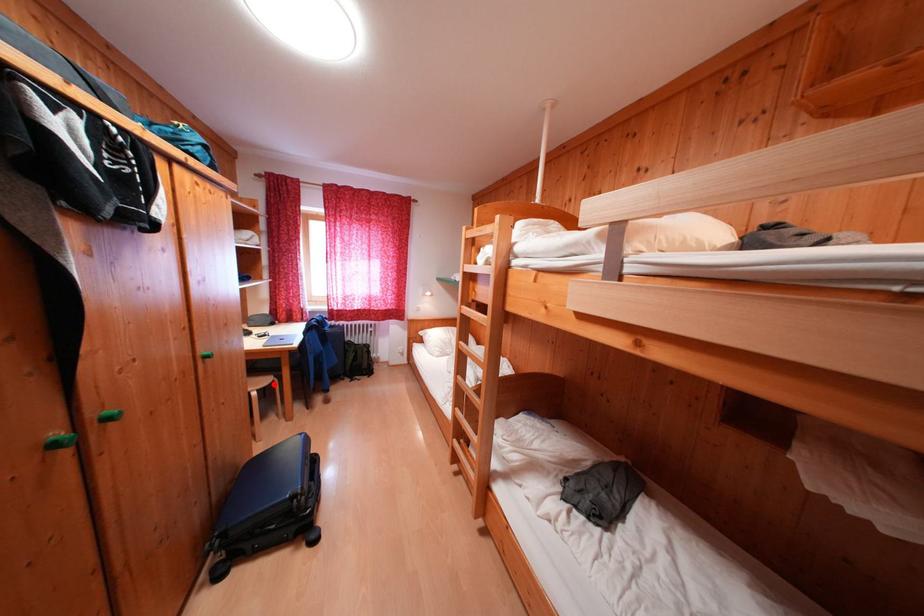
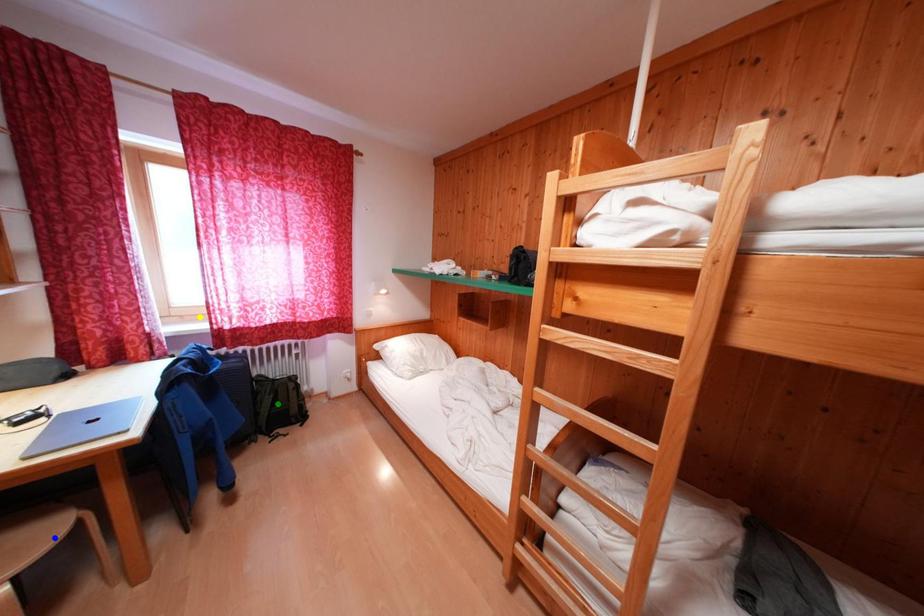
Question: I am providing you with two images of the same scene from different viewpoints. A red point is marked on the first image. You are given multiple points on the second image. Can you choose the point in image 2 that corresponds to the point in image 1?

Choices:
 (A) green point
 (B) yellow point
 (C) blue point

Answer: (C)